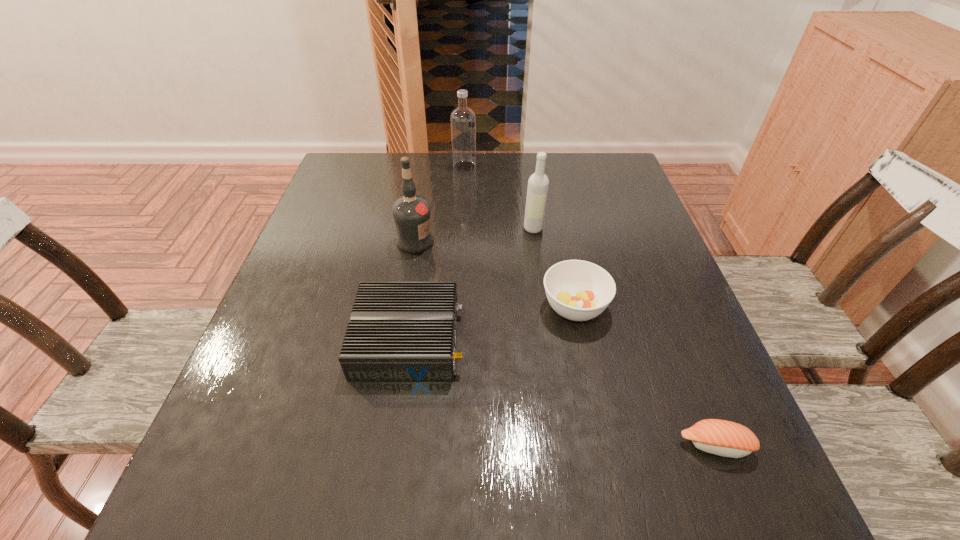
The image size is (960, 540). In the image, there is a desktop. Identify the location of vacant space at the near left corner. (244, 490).

What are the coordinates of `vacant space at the far right corner` in the screenshot? It's located at (577, 173).

Where is `free space at the near right corner of the desktop`? free space at the near right corner of the desktop is located at coordinates (667, 509).

This screenshot has width=960, height=540. I want to click on free space between the second vodka from left to right and the rightmost vodka, so click(499, 197).

Where is `free space that is in between the rightmost vodka and the farthest vodka`? free space that is in between the rightmost vodka and the farthest vodka is located at coordinates point(499,197).

What are the coordinates of `free space between the rightmost vodka and the leftmost vodka` in the screenshot? It's located at (474, 235).

In order to click on empty space that is in between the leftmost vodka and the sushi in this screenshot , I will do `click(565, 343)`.

At what (x,y) coordinates should I click in order to perform the action: click on free space between the rightmost vodka and the farthest object. Please return your answer as a coordinate pair (x, y). The height and width of the screenshot is (540, 960). Looking at the image, I should click on (499, 197).

Find the location of a particular element. This screenshot has height=540, width=960. vacant region between the rightmost vodka and the leftmost vodka is located at coordinates (474, 235).

Locate an element on the screen. The height and width of the screenshot is (540, 960). vacant region between the soup bowl and the farthest vodka is located at coordinates (519, 237).